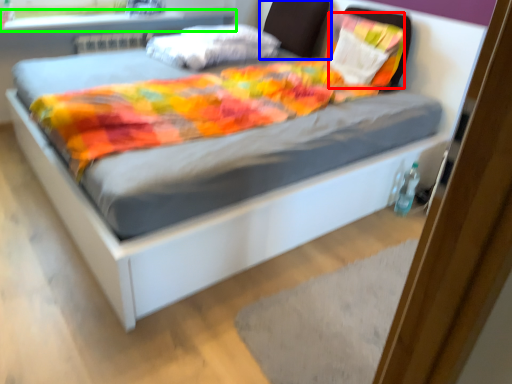
Question: Estimate the real-world distances between objects in this image. Which object is farther from pillow (highlighted by a red box), headboard (highlighted by a blue box) or window sill (highlighted by a green box)?

Choices:
 (A) headboard
 (B) window sill

Answer: (B)